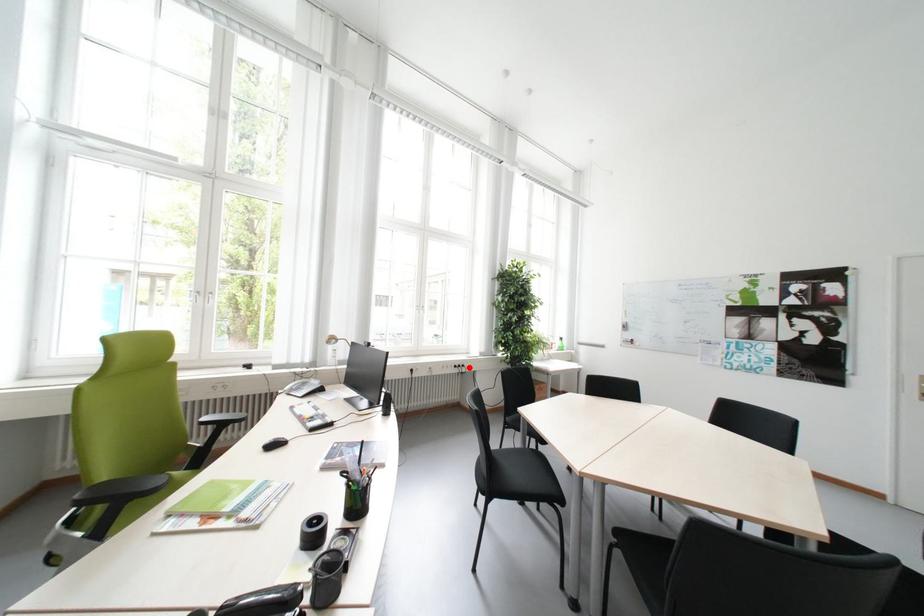
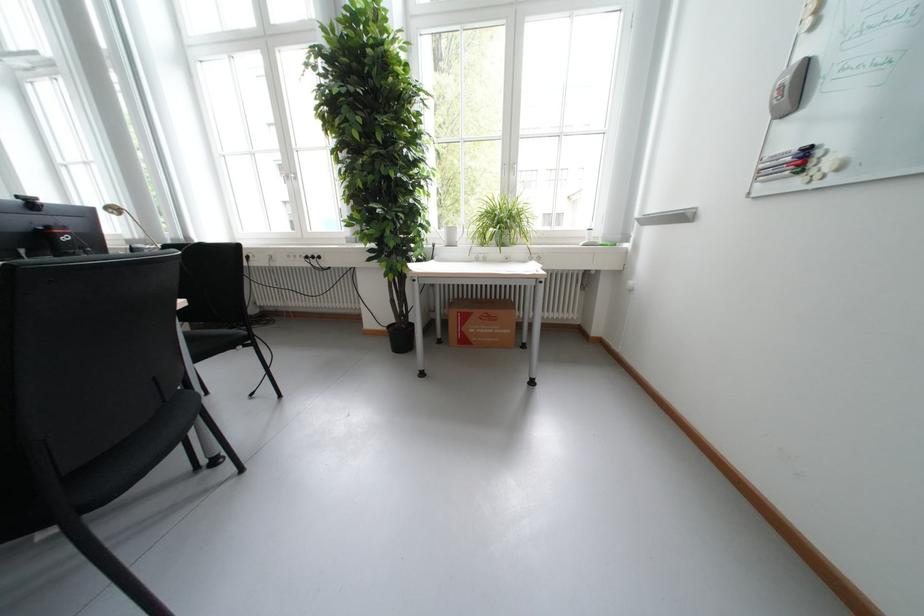
Question: A red point is marked in image1. In image2, is the corresponding 3D point closer to the camera or farther? Reply with the corresponding letter.

Choices:
 (A) The corresponding 3D point is closer.
 (B) The corresponding 3D point is farther.

Answer: (A)